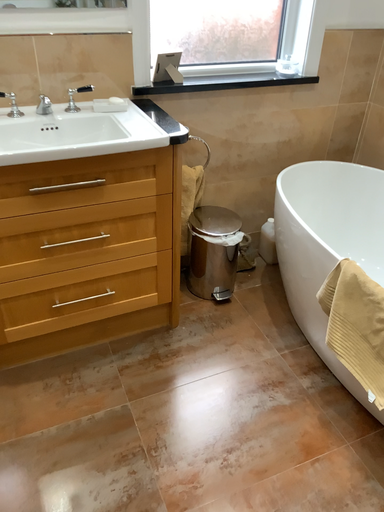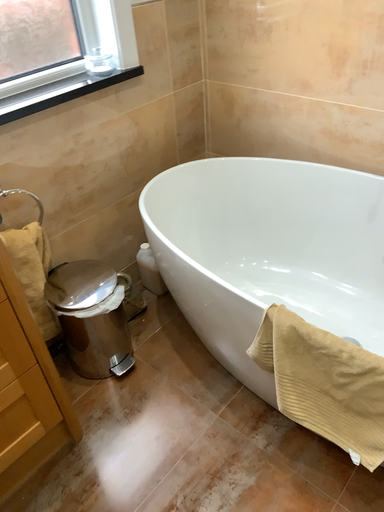
Question: How did the camera likely rotate when shooting the video?

Choices:
 (A) rotated right
 (B) rotated left

Answer: (A)